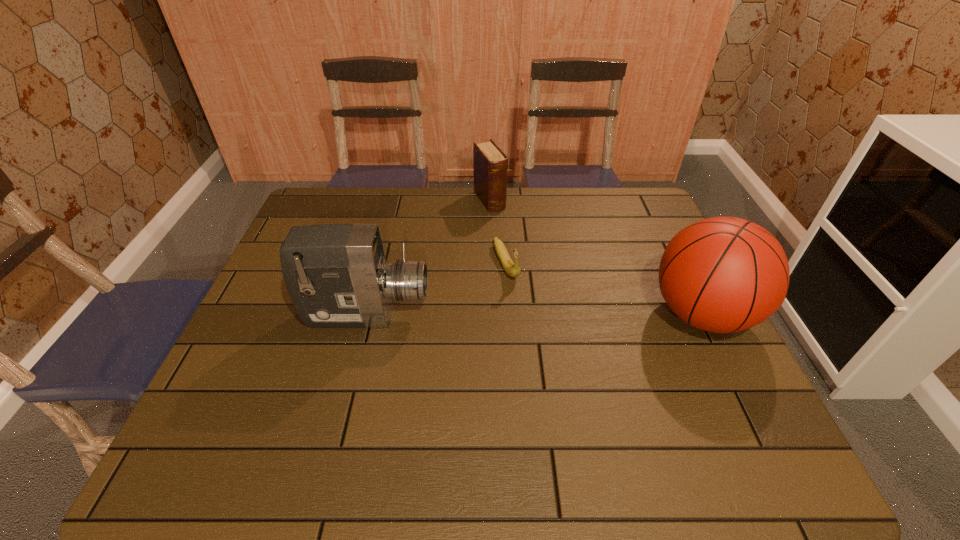
Where is `free space located 0.120m at the stem of the shortest object`? free space located 0.120m at the stem of the shortest object is located at coordinates (526, 314).

Image resolution: width=960 pixels, height=540 pixels. Find the location of `free space located at the stem of the shortest object`. free space located at the stem of the shortest object is located at coordinates (521, 303).

Locate an element on the screen. The width and height of the screenshot is (960, 540). free point located at the stem of the shortest object is located at coordinates (540, 340).

This screenshot has width=960, height=540. What are the coordinates of `object present at the far edge` in the screenshot? It's located at (490, 165).

The width and height of the screenshot is (960, 540). What are the coordinates of `object located in the left edge section of the desktop` in the screenshot? It's located at (337, 276).

Where is `object at the right edge`? The height and width of the screenshot is (540, 960). object at the right edge is located at coordinates (725, 274).

Where is `free spot at the far edge of the desktop`? This screenshot has height=540, width=960. free spot at the far edge of the desktop is located at coordinates (427, 216).

In the image, there is a desktop. In order to click on vacant space at the right edge in this screenshot , I will do `click(690, 326)`.

At what (x,y) coordinates should I click in order to perform the action: click on free space at the far left corner. Please return your answer as a coordinate pair (x, y). The width and height of the screenshot is (960, 540). Looking at the image, I should click on (301, 218).

This screenshot has width=960, height=540. I want to click on free space at the near left corner of the desktop, so click(274, 411).